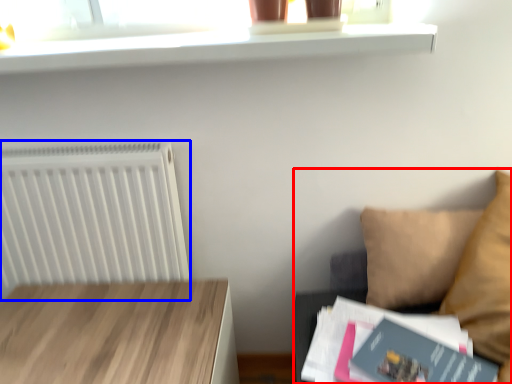
Question: Which point is closer to the camera, couch (highlighted by a red box) or radiator (highlighted by a blue box)?

Choices:
 (A) couch
 (B) radiator

Answer: (A)